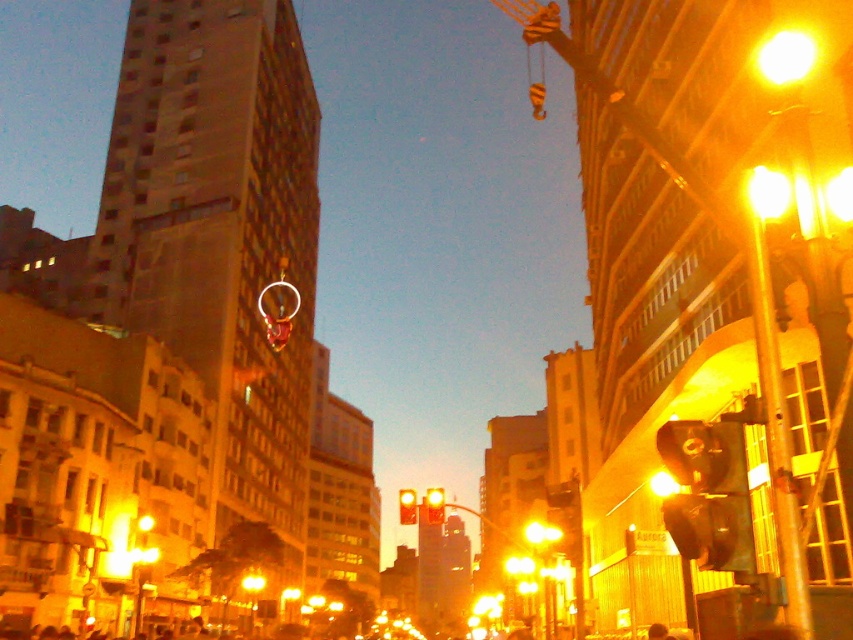
You are a pedestrian standing at the crosswalk and see both the matte black traffic light at right and the yellow glass traffic light at center. Which traffic light is closer to your right side?

The matte black traffic light at right is positioned on the right side of yellow glass traffic light at center, so it is closer to your right side.